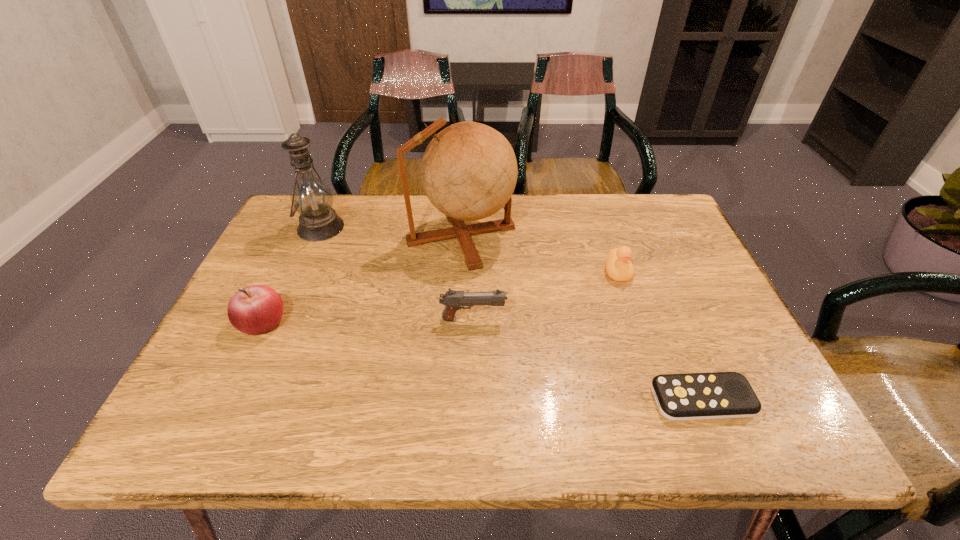
Image resolution: width=960 pixels, height=540 pixels. In order to click on vacant area that satisfies the following two spatial constraints: 1. on the back side of the oil lamp; 2. on the left side of the apple in this screenshot , I will do `click(308, 227)`.

This screenshot has width=960, height=540. Find the location of `free point that satisfies the following two spatial constraints: 1. in the direction the gun is aimed; 2. on the left side of the shortest object`. free point that satisfies the following two spatial constraints: 1. in the direction the gun is aimed; 2. on the left side of the shortest object is located at coordinates (472, 399).